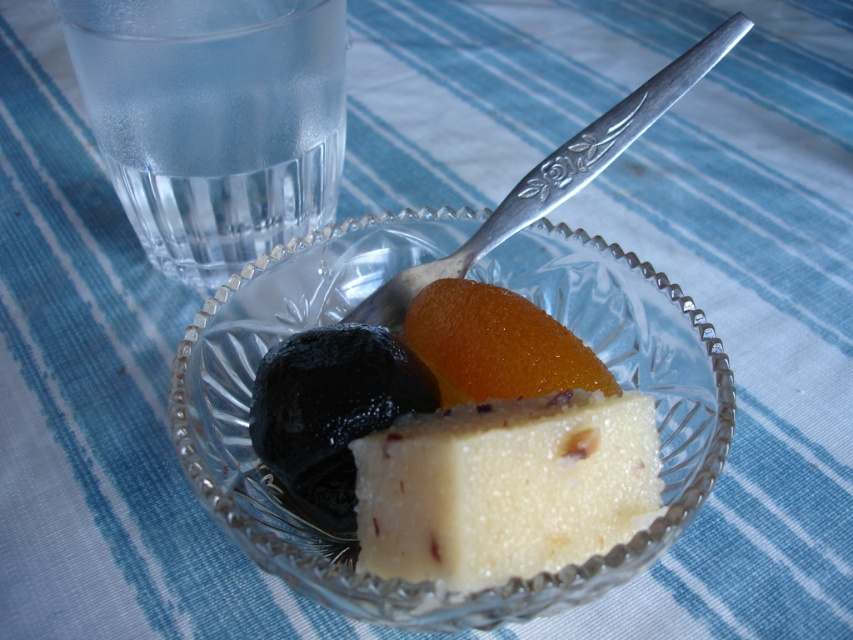
You are at a party and want to grab a drink. There is a transparent glass water at upper left and a white crumbly cheese at center. Which one is taller?

The transparent glass water at upper left is taller than the white crumbly cheese at center.

You are at the position of the camera. The transparent glass water at upper left is located at point A. The glass bowl with the spoon is at point B. What is the direction of point B relative to point A?

The transparent glass water at upper left is located at point A. The glass bowl with the spoon is at point B. Since the bowl is to the right of the glass, point B is to the right of point A.

You are at a party and want to grab the glossy orange fruit at center without touching the clear crystal bowl at center. Is there enough space between them to do so?

The clear crystal bowl at center and glossy orange fruit at center are 1.54 inches apart, so yes, there is enough space to grab the glossy orange fruit at center without touching the clear crystal bowl at center.